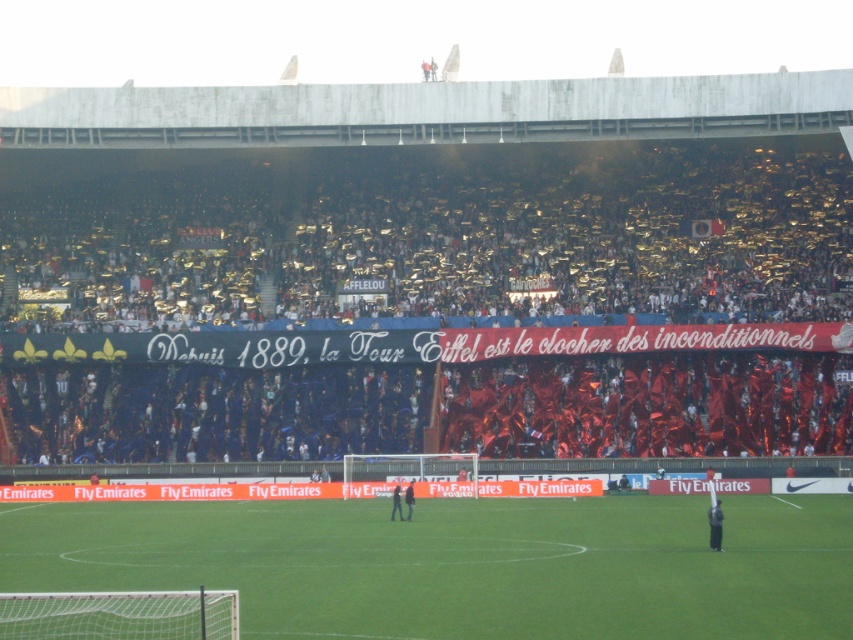
Question: Does green grass football field at center have a lesser width compared to dark blue jersey at center?

Choices:
 (A) no
 (B) yes

Answer: (A)

Question: Among these points, which one is nearest to the camera?

Choices:
 (A) (405, 509)
 (B) (396, 508)

Answer: (B)

Question: Can you confirm if dark gray fabric jacket at center is positioned to the left of dark blue fabric jacket at center?

Choices:
 (A) yes
 (B) no

Answer: (B)

Question: Does green grass football field at center appear over dark blue jersey at center?

Choices:
 (A) no
 (B) yes

Answer: (A)

Question: Which object is closer to the camera taking this photo?

Choices:
 (A) dark blue fabric jacket at center
 (B) green grass football field at center

Answer: (B)

Question: Which point is closer to the camera?

Choices:
 (A) green grass football field at center
 (B) dark gray fabric jacket at center
 (C) dark blue fabric jacket at center
 (D) dark blue jersey at center

Answer: (A)